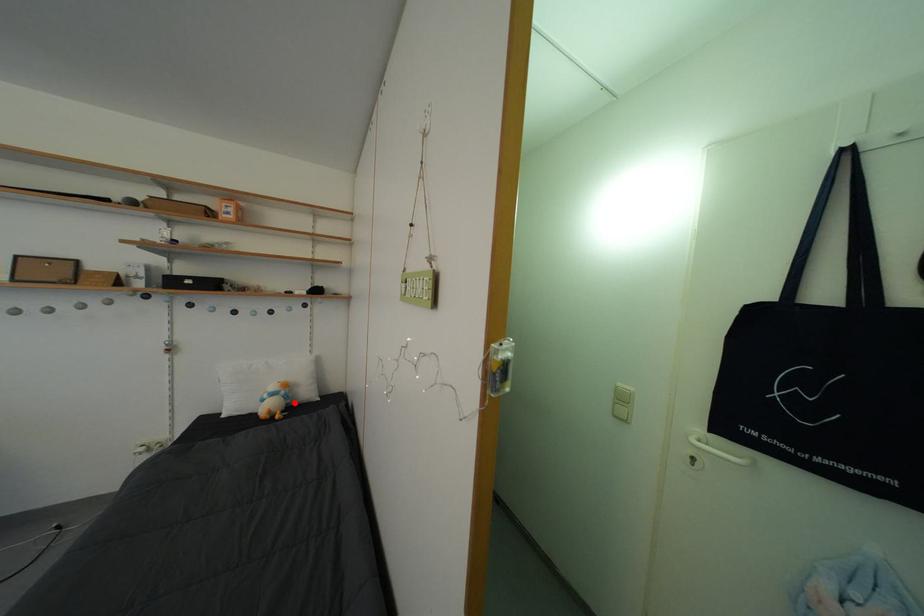
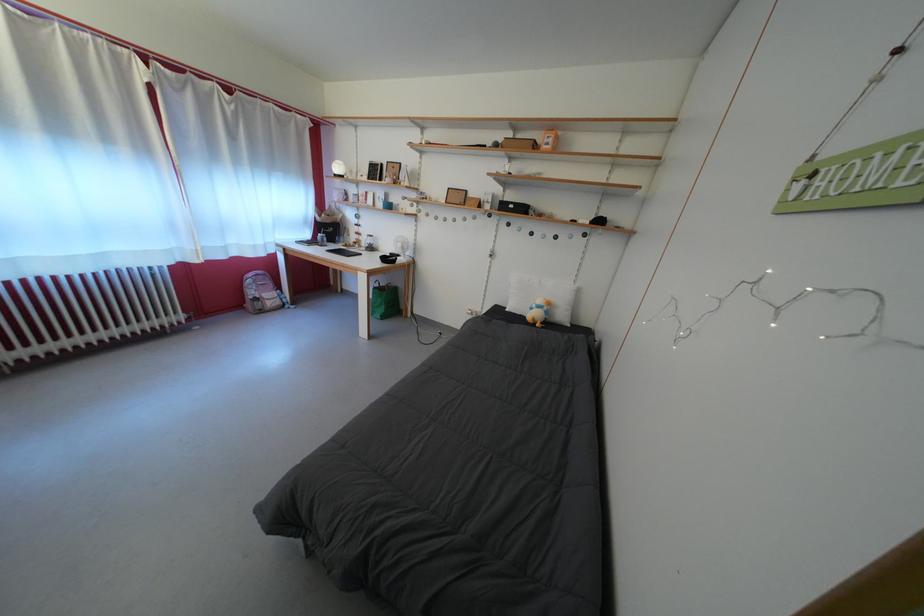
Where in the second image is the point corresponding to the highlighted location from the first image?

(554, 318)